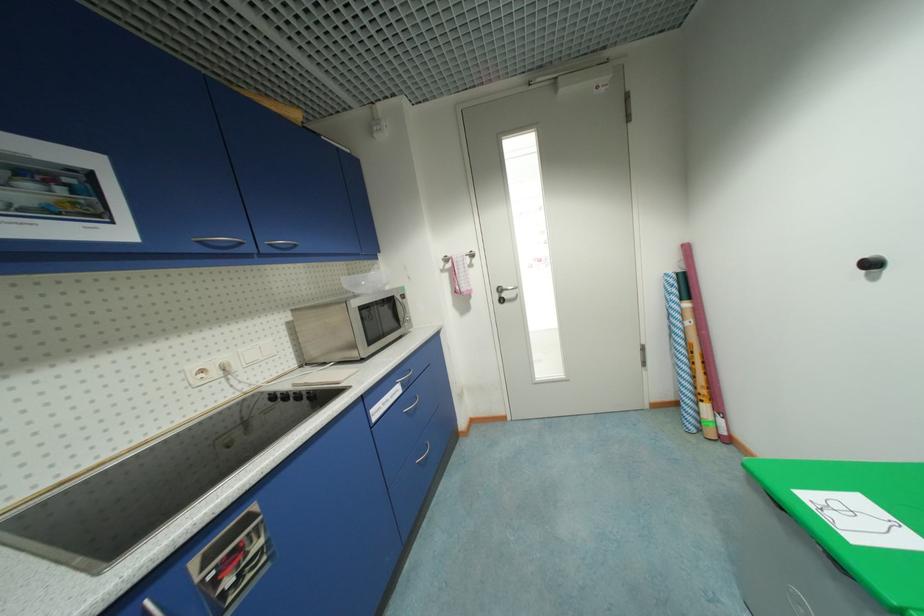
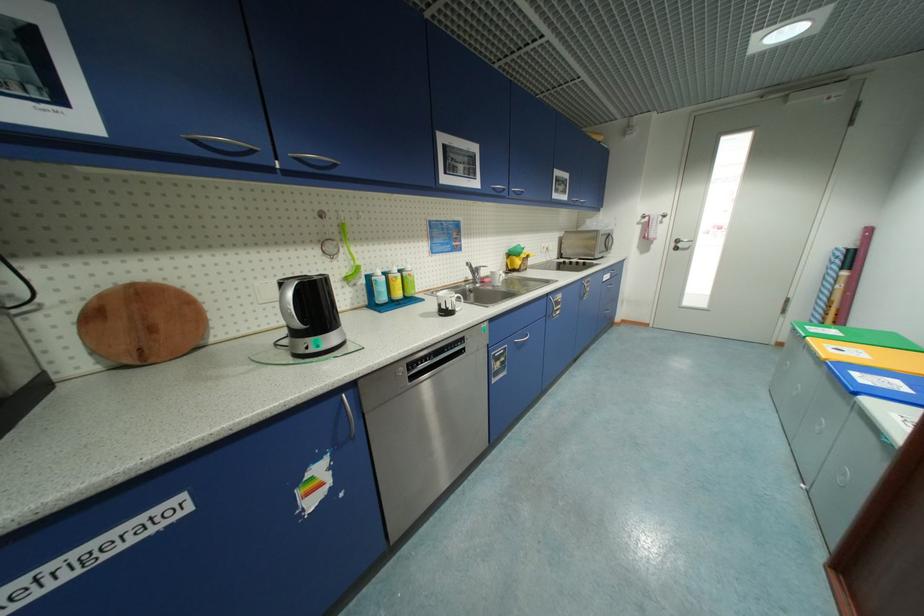
Where in the second image is the point corresponding to [127,235] from the first image?

(570, 199)